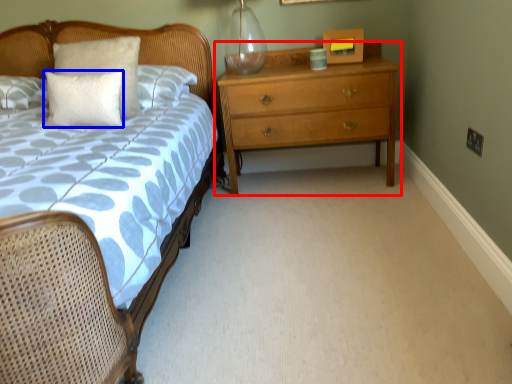
Question: Which of the following is the closest to the observer, chest of drawers (highlighted by a red box) or pillow (highlighted by a blue box)?

Choices:
 (A) chest of drawers
 (B) pillow

Answer: (B)